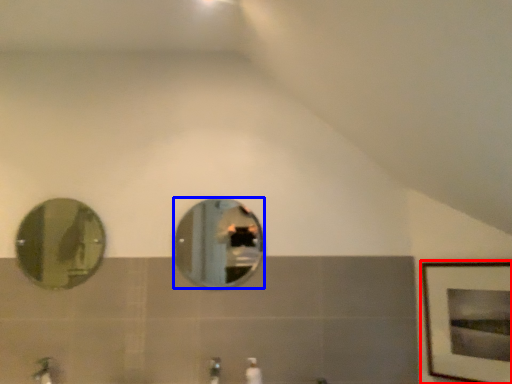
Question: Which object appears closest to the camera in this image, picture frame (highlighted by a red box) or mirror (highlighted by a blue box)?

Choices:
 (A) picture frame
 (B) mirror

Answer: (A)